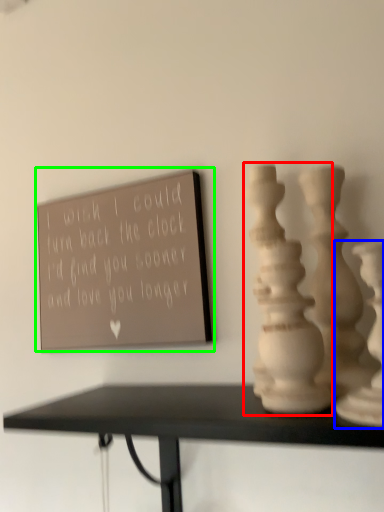
Question: Considering the real-world distances, which object is closest to vase (highlighted by a red box)? vase (highlighted by a blue box) or bulletin board (highlighted by a green box).

Choices:
 (A) vase
 (B) bulletin board

Answer: (A)